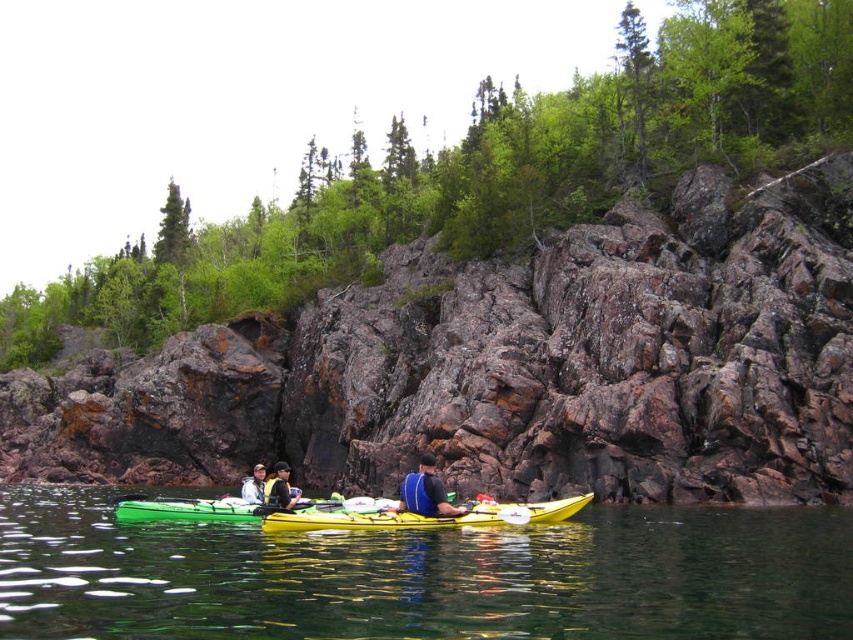
You are a photographer trying to capture the green rubber kayak at lower center and the blue fabric life vest at center in the same frame. Based on their positions, which object would appear closer to the bottom of the photo?

The green rubber kayak at lower center appears closer to the bottom of the photo because it is positioned below the blue fabric life vest at center.

You are a photographer trying to capture a clear shot of the green rubber kayak at lower center and the blue fabric life vest at center. Since you want the kayak to be the main focus, should you adjust your camera to focus on the foreground or background?

The green rubber kayak at lower center is in front of the blue fabric life vest at center, so to focus on the kayak as the main subject, adjust your camera to focus on the foreground.

Consider the image. You are a photographer trying to capture the kayakers from the shore. You notice the yellow plastic kayak at center and the light gray fabric jacket at lower left. Which object should you focus on first if you want to photograph the one closer to the water surface?

The light gray fabric jacket at lower left is closer to the water surface, so you should focus on it first.